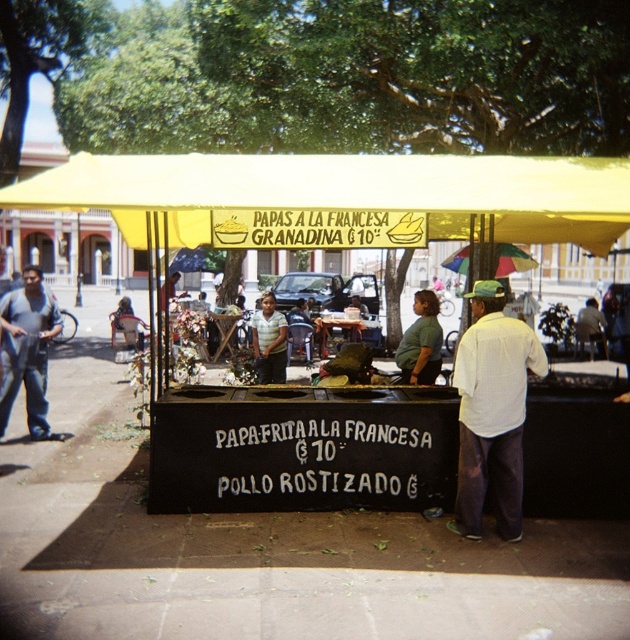
Question: Which point is closer to the camera?

Choices:
 (A) (323, 195)
 (B) (474, 289)
 (C) (32, 326)
 (D) (282, 355)

Answer: (A)

Question: Which point is closer to the camera taking this photo?

Choices:
 (A) [461, 417]
 (B) [45, 410]
 (C) [277, 344]

Answer: (A)

Question: Estimate the real-world distances between objects in this image. Which object is closer to the yellow fabric canopy at center?

Choices:
 (A) striped shirt at center
 (B) white textured shirt at center
 (C) gray cotton pants at left

Answer: (B)

Question: Is gray cotton pants at left above striped shirt at center?

Choices:
 (A) yes
 (B) no

Answer: (B)

Question: Can you confirm if white textured shirt at center is wider than gray cotton pants at left?

Choices:
 (A) no
 (B) yes

Answer: (B)

Question: Does gray cotton pants at left appear under striped shirt at center?

Choices:
 (A) yes
 (B) no

Answer: (A)